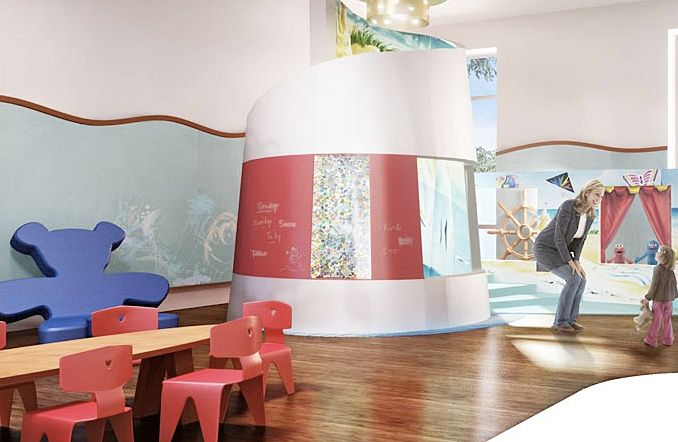
This screenshot has height=442, width=678. I want to click on chalkboard, so click(81, 189).